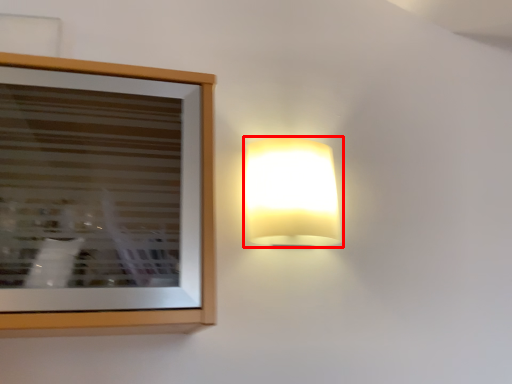
Question: In this image, where is lamp (annotated by the red box) located relative to picture frame?

Choices:
 (A) right
 (B) left

Answer: (A)